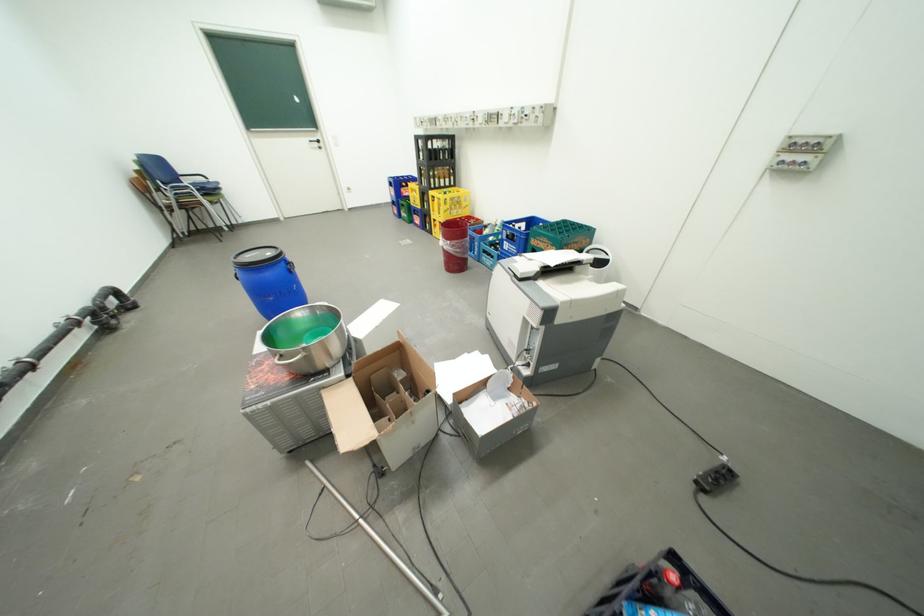
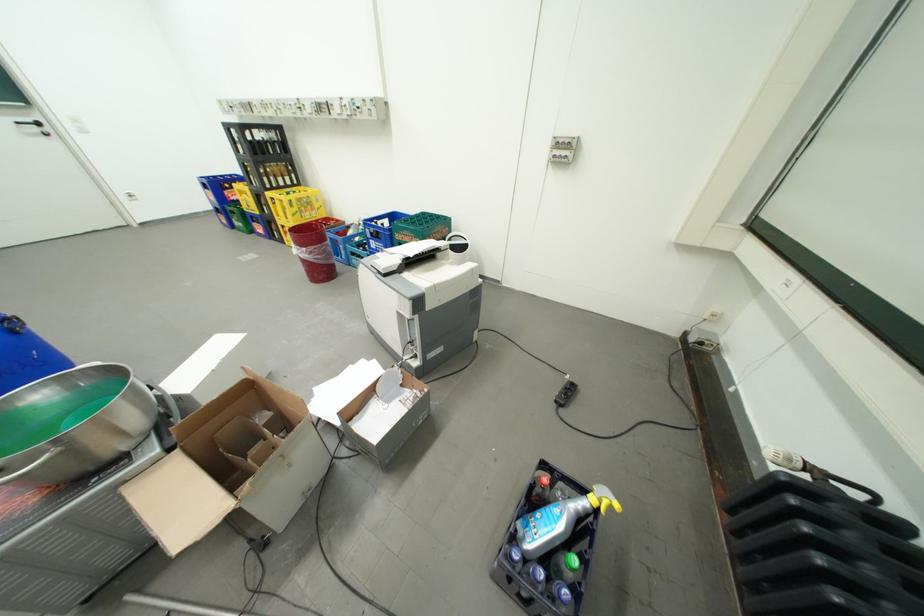
Find the pixel in the second image that matches point 516,244 in the first image.

(381, 241)